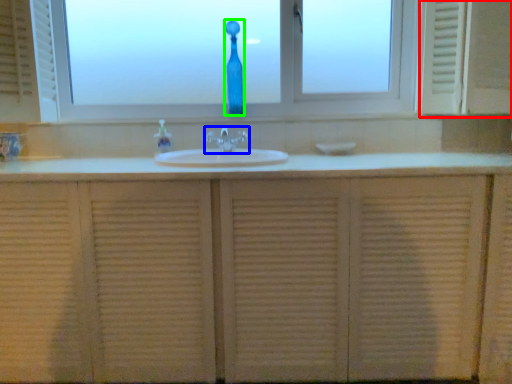
Question: Based on their relative distances, which object is farther from medicine cabinet (highlighted by a red box)? Choose from tap (highlighted by a blue box) and glass vase (highlighted by a green box).

Choices:
 (A) tap
 (B) glass vase

Answer: (B)